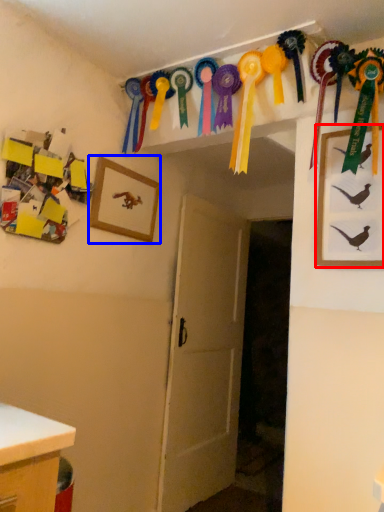
Question: Which of the following is the farthest to the observer, picture frame (highlighted by a red box) or picture frame (highlighted by a blue box)?

Choices:
 (A) picture frame
 (B) picture frame

Answer: (B)